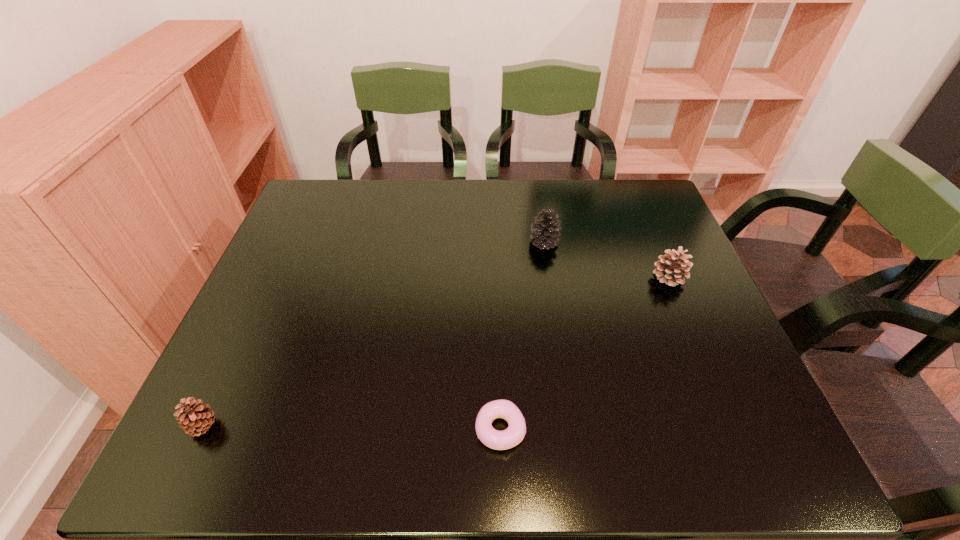
Where is `the farthest pinecone`? Image resolution: width=960 pixels, height=540 pixels. the farthest pinecone is located at coordinates (545, 229).

This screenshot has height=540, width=960. I want to click on the farthest object, so click(545, 229).

In order to click on the third nearest object in this screenshot , I will do `click(670, 269)`.

Find the location of a particular element. The image size is (960, 540). the second nearest pinecone is located at coordinates (670, 269).

Where is `the leftmost pinecone`? the leftmost pinecone is located at coordinates (195, 419).

Locate an element on the screen. This screenshot has height=540, width=960. the nearest pinecone is located at coordinates pos(195,419).

Image resolution: width=960 pixels, height=540 pixels. Identify the location of the shortest object. (499, 440).

Find the location of a particular element. the second object from left to right is located at coordinates (499, 440).

Find the location of a particular element. free space located on the left of the farthest pinecone is located at coordinates (455, 242).

I want to click on vacant space located 0.240m on the back of the second nearest pinecone, so click(641, 212).